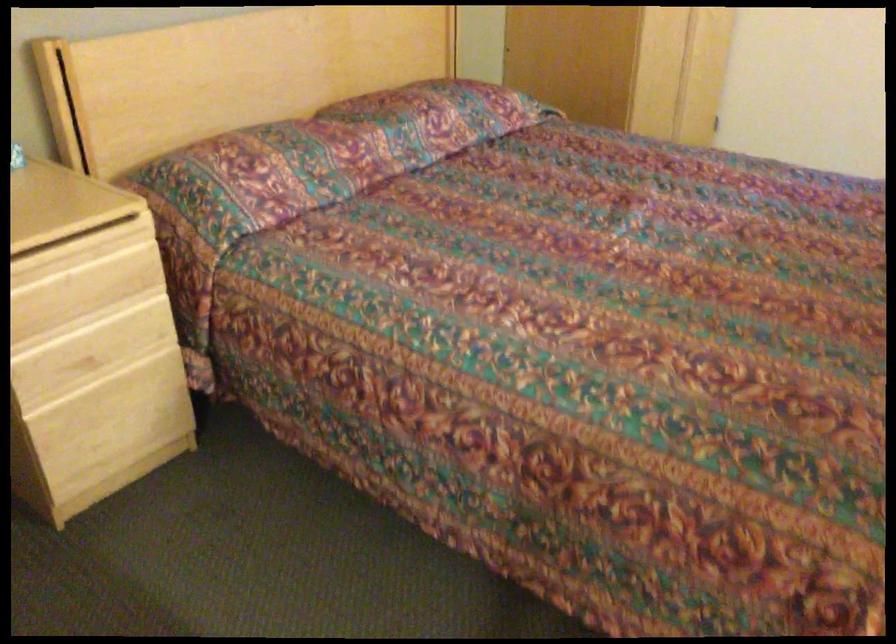
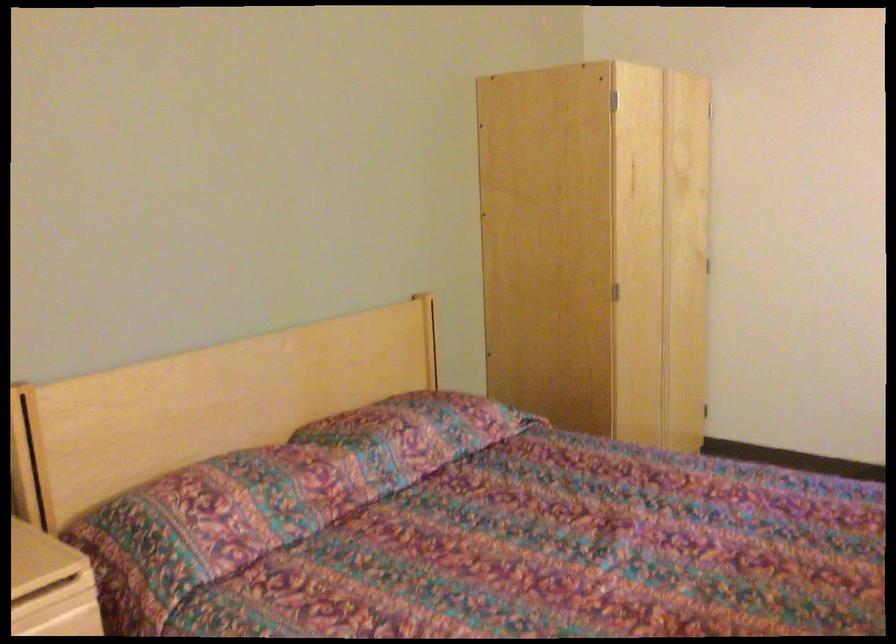
Find the pixel in the second image that matches (254,175) in the first image.

(211, 518)